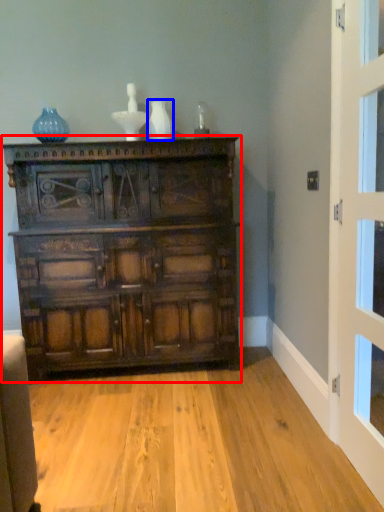
Question: Which point is further to the camera, chest of drawers (highlighted by a red box) or vase (highlighted by a blue box)?

Choices:
 (A) chest of drawers
 (B) vase

Answer: (B)